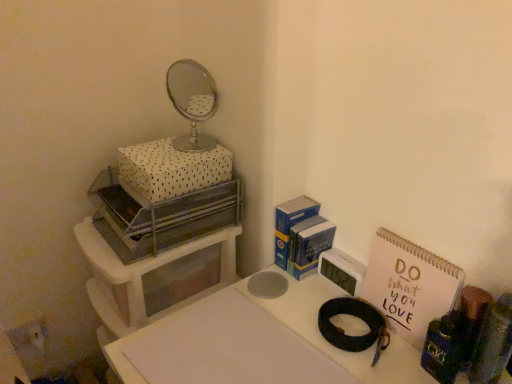
The image size is (512, 384). In order to click on free spot in front of white plastic clock at center-right, the second appliance viewed from the right in this screenshot , I will do `click(337, 343)`.